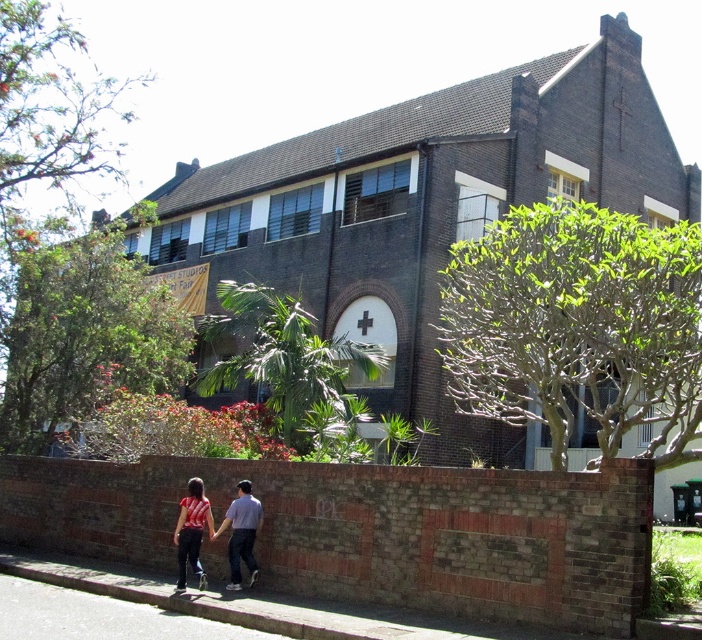
Question: Is matte red shirt at lower center positioned behind striped fabric shirt at lower center?

Choices:
 (A) yes
 (B) no

Answer: (B)

Question: Can you confirm if matte red shirt at lower center is bigger than striped fabric shirt at lower center?

Choices:
 (A) yes
 (B) no

Answer: (A)

Question: Is matte red shirt at lower center below striped fabric shirt at lower center?

Choices:
 (A) yes
 (B) no

Answer: (B)

Question: Which point is farther from the camera taking this photo?

Choices:
 (A) (187, 497)
 (B) (251, 518)

Answer: (A)

Question: Which point is farther from the camera taking this photo?

Choices:
 (A) 180,563
 (B) 183,516

Answer: (B)